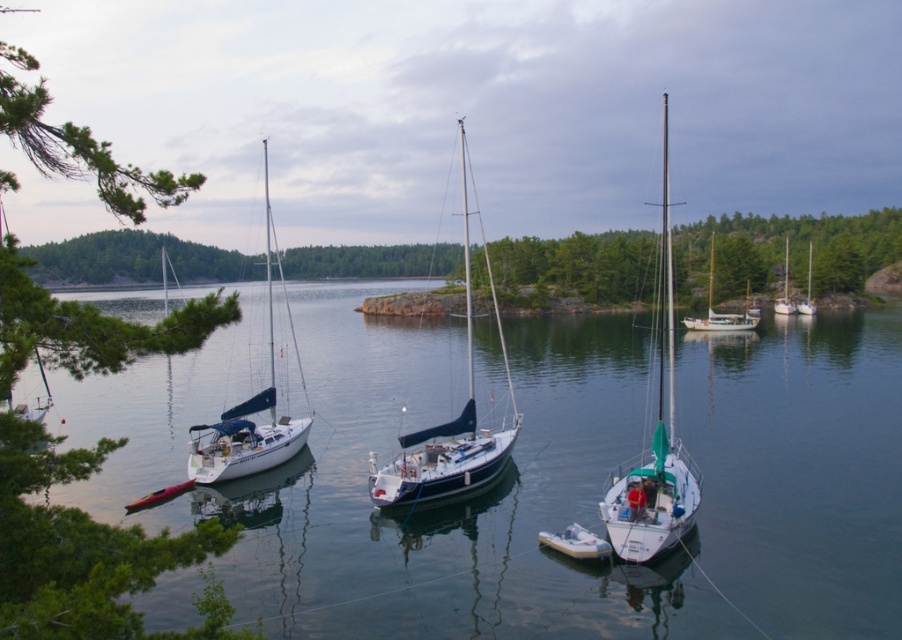
You are planning to take a photo of the blue glossy sailboat at center from the shore. Since the clear water at center is in the way, will you need to adjust your position to avoid it?

The clear water at center is larger in size than the blue glossy sailboat at center, so it might obstruct the view. To take a clear photo of the blue glossy sailboat at center, you may need to adjust your position to ensure the sailboat is not blocked by the water.

You are standing at the point marked as point (x=665, y=140) in the marina scene. You want to take a photo of the entire marina, but your camera has a maximum range of 150 meters. Will you be able to capture the entire scene with your camera?

The distance between point (x=665, y=140) and the camera is 189.61 meters, which exceeds the camera maximum range of 150 meters. Therefore, you will not be able to capture the entire scene with your camera.